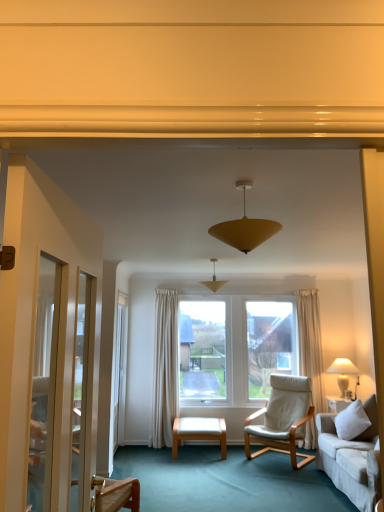
Question: Visually, is white leather ottoman at center positioned to the left or to the right of white leather chair at center?

Choices:
 (A) left
 (B) right

Answer: (A)

Question: Considering the positions of white leather ottoman at center and white leather chair at center in the image, is white leather ottoman at center wider or thinner than white leather chair at center?

Choices:
 (A) wide
 (B) thin

Answer: (B)

Question: Which of these objects is positioned closest to the white leather chair at center?

Choices:
 (A) white glossy screen door at left
 (B) white fabric pillow at lower right
 (C) white leather ottoman at center
 (D) matte yellow cone at center, arranged as the 2th lamp when viewed from the front
 (E) matte yellow cone at center, which is the 1th lamp in front-to-back order

Answer: (C)

Question: Which is nearer to the matte yellow cone at center, the 2th lamp viewed from the top?

Choices:
 (A) white leather ottoman at center
 (B) white fabric lampshade at right, the 3th lamp positioned from the left
 (C) white glossy screen door at left
 (D) matte yellow cone at center, acting as the 1th lamp starting from the top
 (E) white leather chair at center

Answer: (C)